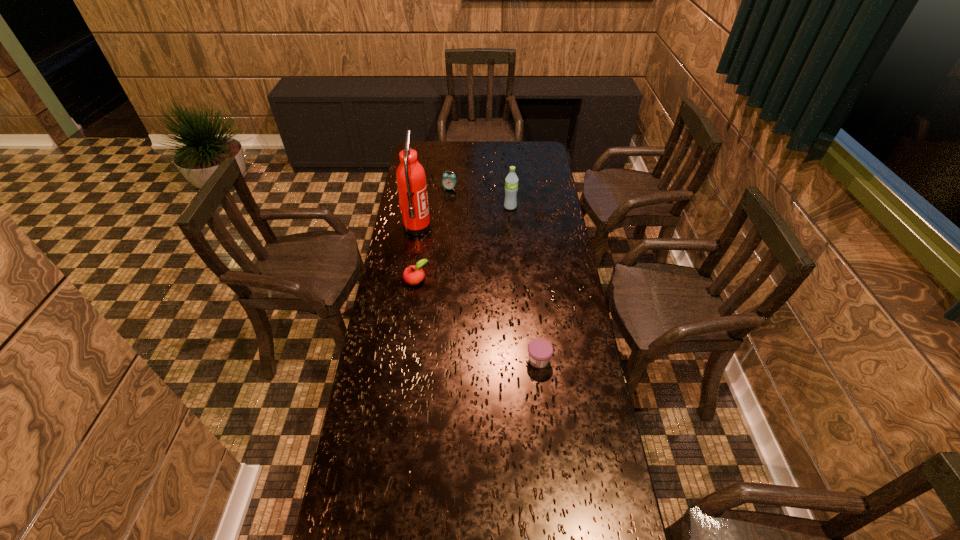
The width and height of the screenshot is (960, 540). Identify the location of vacant space at the far right corner of the desktop. (544, 150).

You are a GUI agent. You are given a task and a screenshot of the screen. Output one action in this format:
    pyautogui.click(x=<x>, y=<y>)
    Task: Click on the empty space that is in between the third object from left to right and the fourth nearest object
    The width and height of the screenshot is (960, 540).
    Given the screenshot: What is the action you would take?
    pyautogui.click(x=433, y=208)

This screenshot has width=960, height=540. Find the location of `unoccupied position between the fifth shortest object and the fourth object from right to left`. unoccupied position between the fifth shortest object and the fourth object from right to left is located at coordinates (480, 198).

The image size is (960, 540). I want to click on vacant space that is in between the fifth farthest object and the fourth farthest object, so click(477, 320).

The height and width of the screenshot is (540, 960). Identify the location of vacant space in between the third farthest object and the fourth object from right to left. (433, 208).

Image resolution: width=960 pixels, height=540 pixels. Find the location of `free spot between the second nearest object and the third farthest object`. free spot between the second nearest object and the third farthest object is located at coordinates (478, 294).

I want to click on vacant space in between the fourth shortest object and the fourth farthest object, so click(x=433, y=234).

This screenshot has width=960, height=540. Find the location of `free space between the alarm clock and the water bottle`. free space between the alarm clock and the water bottle is located at coordinates point(480,198).

You are a GUI agent. You are given a task and a screenshot of the screen. Output one action in this format:
    pyautogui.click(x=<x>, y=<y>)
    Task: Click on the empty space that is in between the jam and the apple
    This screenshot has width=960, height=540.
    Given the screenshot: What is the action you would take?
    pyautogui.click(x=477, y=320)

Locate an element on the screen. free space between the third farthest object and the jam is located at coordinates (478, 294).